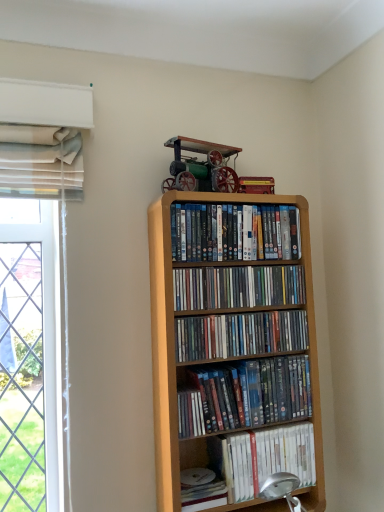
Question: Does matte plastic dvds at upper center, the first book viewed from the top, have a lesser width compared to matte plastic dvds at center, positioned as the 2th book in bottom-to-top order?

Choices:
 (A) no
 (B) yes

Answer: (A)

Question: Is matte plastic dvds at upper center, the first book viewed from the top, placed right next to matte plastic dvds at center, placed as the fourth book when sorted from top to bottom?

Choices:
 (A) no
 (B) yes

Answer: (A)

Question: From the image's perspective, does matte plastic dvds at upper center, the first book viewed from the top, appear lower than matte plastic dvds at center, placed as the fourth book when sorted from top to bottom?

Choices:
 (A) yes
 (B) no

Answer: (B)

Question: Is the position of matte plastic dvds at upper center, which is the 5th book in bottom-to-top order, more distant than that of matte plastic dvds at center, positioned as the 2th book in bottom-to-top order?

Choices:
 (A) yes
 (B) no

Answer: (A)

Question: From a real-world perspective, is matte plastic dvds at upper center, the first book viewed from the top, positioned over matte plastic dvds at center, positioned as the 2th book in bottom-to-top order, based on gravity?

Choices:
 (A) no
 (B) yes

Answer: (B)

Question: From a real-world perspective, is matte plastic dvds at upper center, the first book viewed from the top, beneath matte plastic dvds at center, positioned as the 2th book in bottom-to-top order?

Choices:
 (A) no
 (B) yes

Answer: (A)

Question: Can you confirm if light wood bookcase at center is positioned to the right of white matte paperback book at lower center?

Choices:
 (A) no
 (B) yes

Answer: (B)

Question: Does light wood bookcase at center have a greater height compared to white matte paperback book at lower center?

Choices:
 (A) no
 (B) yes

Answer: (B)

Question: Would you say white matte paperback book at lower center is part of light wood bookcase at center's contents?

Choices:
 (A) no
 (B) yes

Answer: (B)

Question: From a real-world perspective, does light wood bookcase at center sit lower than white matte paperback book at lower center?

Choices:
 (A) yes
 (B) no

Answer: (B)

Question: Can you confirm if light wood bookcase at center is shorter than white matte paperback book at lower center?

Choices:
 (A) yes
 (B) no

Answer: (B)

Question: Is light wood bookcase at center turned away from white matte paperback book at lower center?

Choices:
 (A) yes
 (B) no

Answer: (A)

Question: Does white matte book at lower right, the 5th book in the top-to-bottom sequence, have a smaller size compared to light wood bookcase at center?

Choices:
 (A) yes
 (B) no

Answer: (A)